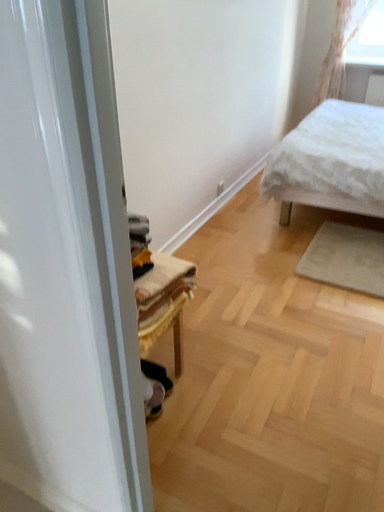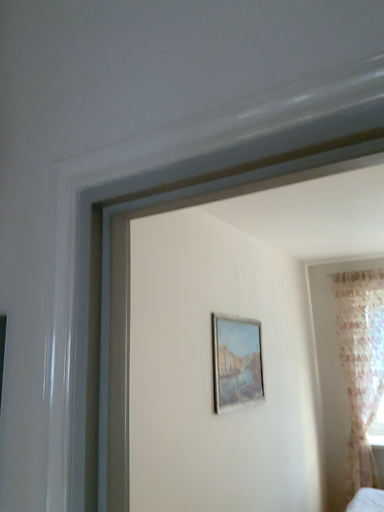
Question: Which way did the camera rotate in the video?

Choices:
 (A) rotated downward
 (B) rotated upward

Answer: (B)